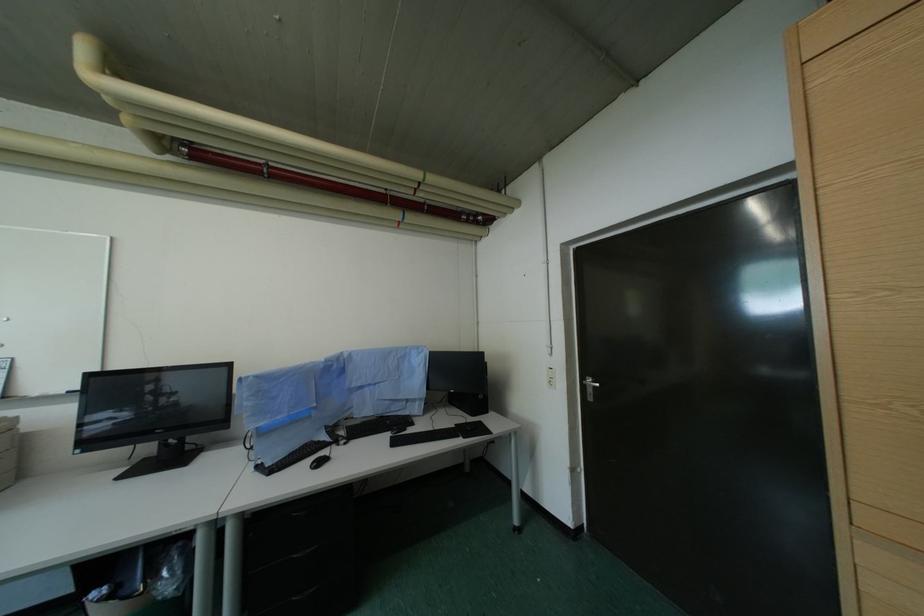
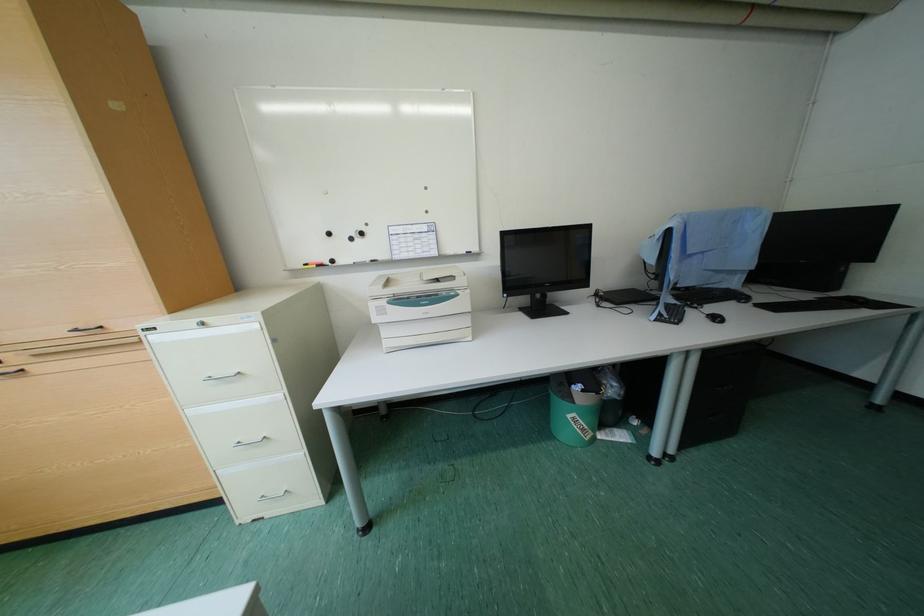
Question: Which direction would the cameraman need to move to produce the second image? Reply with the corresponding letter.

Choices:
 (A) Left
 (B) Right
 (C) Forward
 (D) Backward

Answer: (A)